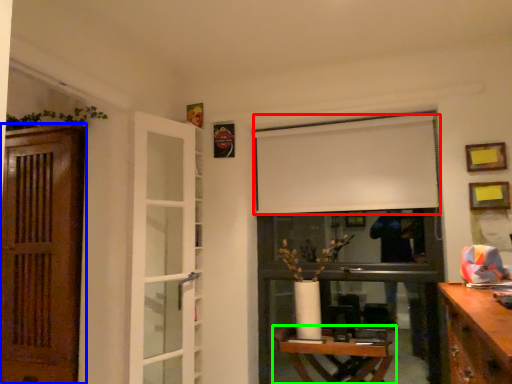
Question: Considering the real-world distances, which object is closest to curtain (highlighted by a red box)? door (highlighted by a blue box) or table (highlighted by a green box).

Choices:
 (A) door
 (B) table

Answer: (B)